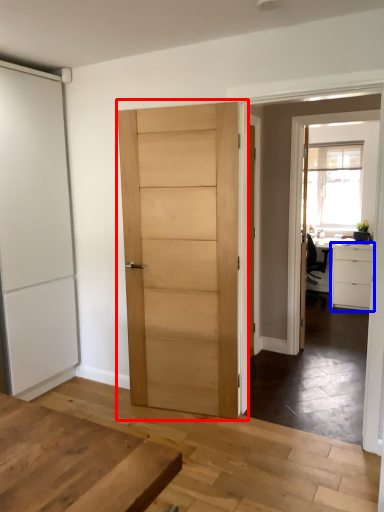
Question: Which point is further to the camera, door (highlighted by a red box) or cabinetry (highlighted by a blue box)?

Choices:
 (A) door
 (B) cabinetry

Answer: (B)